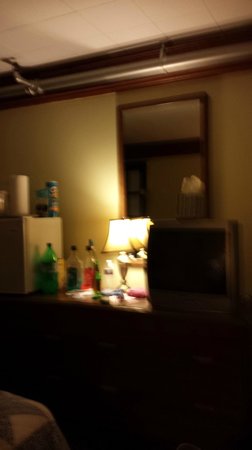
The width and height of the screenshot is (252, 450). Identify the location of refrigerator. (37, 226).